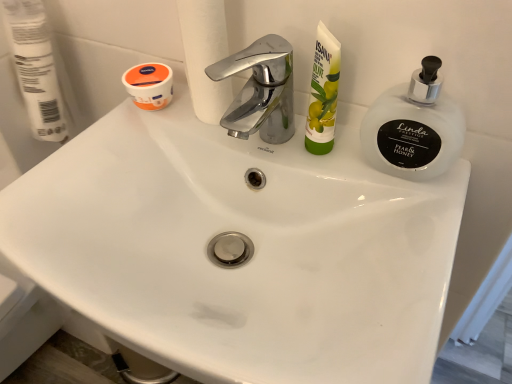
This screenshot has width=512, height=384. I want to click on vacant area in front of green matte tube at upper right, so click(x=381, y=255).